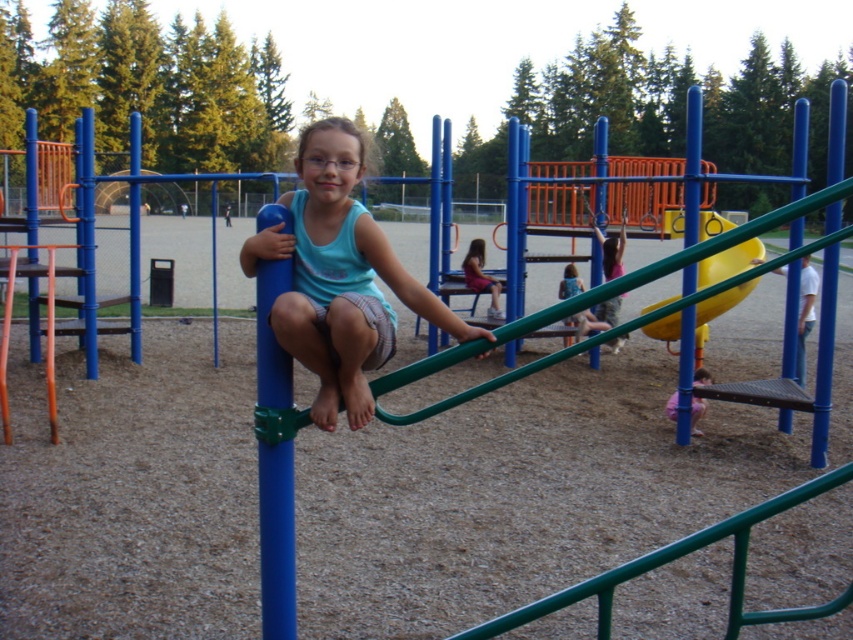
Who is higher up, yellow rubber slide at center or matte blue shorts at center?

Positioned higher is yellow rubber slide at center.

Who is positioned more to the left, yellow rubber slide at center or matte blue shorts at center?

matte blue shorts at center

Is point (740, 300) farther from camera compared to point (560, 298)?

That is False.

The image size is (853, 640). In order to click on yellow rubber slide at center in this screenshot , I will do `click(728, 260)`.

In the scene shown: Can you confirm if yellow rubber slide at center is positioned to the right of blue glossy pole at upper right?

Yes, yellow rubber slide at center is to the right of blue glossy pole at upper right.

From the picture: Who is positioned more to the left, yellow rubber slide at center or blue glossy pole at upper right?

Result: Positioned to the left is blue glossy pole at upper right.

Where is `yellow rubber slide at center`? yellow rubber slide at center is located at coordinates (728, 260).

Does blue rubber pole at center lie behind matte pink shorts at center?

No, it is in front of matte pink shorts at center.

In the scene shown: Does blue rubber pole at center have a greater height compared to matte pink shorts at center?

Yes.

What do you see at coordinates (274, 458) in the screenshot?
I see `blue rubber pole at center` at bounding box center [274, 458].

I want to click on blue rubber pole at center, so click(274, 458).